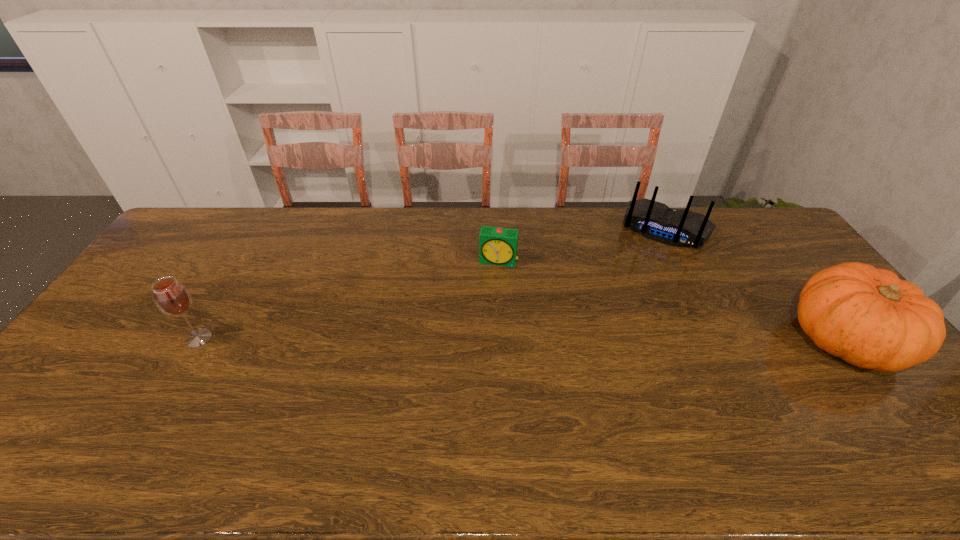
This screenshot has height=540, width=960. What are the coordinates of `vacant space in between the rightmost object and the leftmost object` in the screenshot? It's located at (522, 339).

Identify the location of vacant space that's between the third object from right to left and the router. The width and height of the screenshot is (960, 540). (582, 246).

Identify the location of blank region between the second object from left to right and the pumpkin. The height and width of the screenshot is (540, 960). (672, 300).

In order to click on vacant region between the rightmost object and the alarm clock in this screenshot , I will do `click(672, 300)`.

At what (x,y) coordinates should I click in order to perform the action: click on vacant region between the rightmost object and the wineglass. Please return your answer as a coordinate pair (x, y). Image resolution: width=960 pixels, height=540 pixels. Looking at the image, I should click on (522, 339).

Image resolution: width=960 pixels, height=540 pixels. I want to click on free space that is in between the router and the wineglass, so click(x=432, y=284).

I want to click on vacant space that's between the wineglass and the rightmost object, so click(522, 339).

Find the location of a particular element. The width and height of the screenshot is (960, 540). vacant area that lies between the third object from left to right and the pumpkin is located at coordinates (756, 285).

This screenshot has height=540, width=960. Identify the location of vacant area between the router and the alarm clock. (582, 246).

The height and width of the screenshot is (540, 960). I want to click on object that is the second closest one to the rightmost object, so click(498, 246).